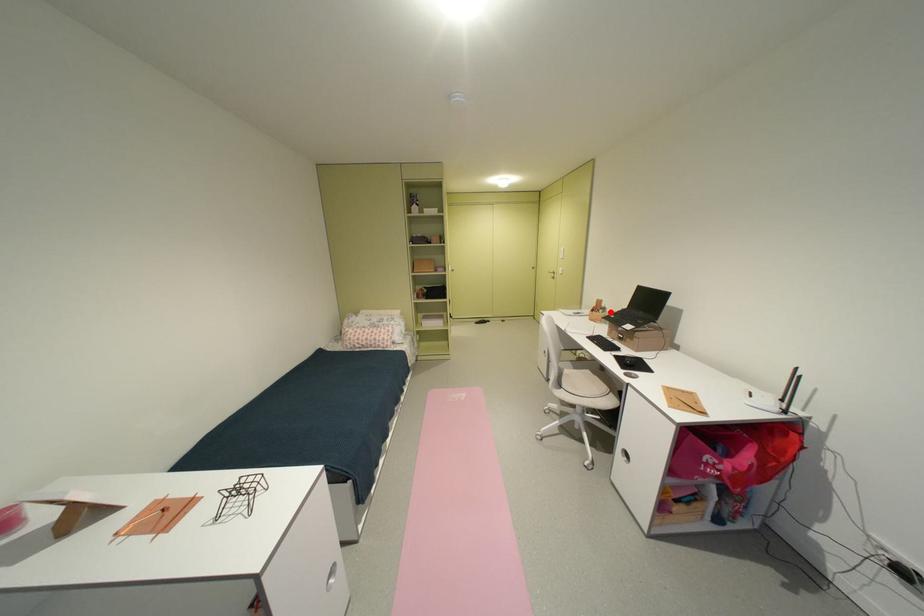
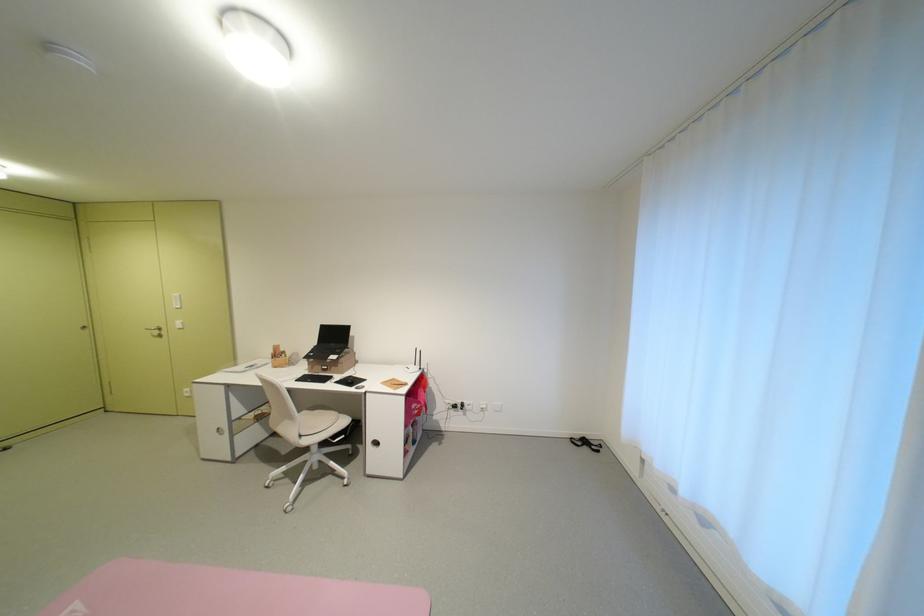
Where in the second image is the point corresponding to the highlighted location from the first image?

(293, 357)